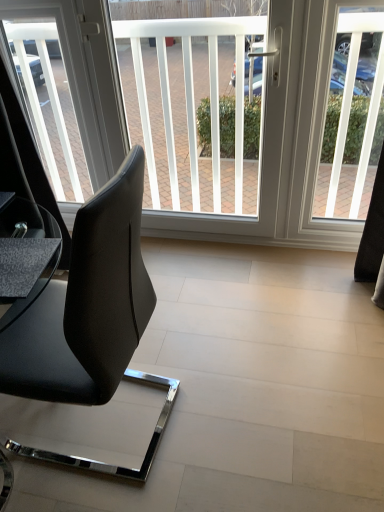
Question: Is transparent glass window screen at upper left, placed as the first window screen when sorted from left to right, thinner than matte black table at lower left?

Choices:
 (A) yes
 (B) no

Answer: (A)

Question: Does transparent glass window screen at upper left, which is the third window screen from right to left, come behind matte black table at lower left?

Choices:
 (A) no
 (B) yes

Answer: (B)

Question: Is transparent glass window screen at upper left, which is the third window screen from right to left, positioned with its back to matte black table at lower left?

Choices:
 (A) no
 (B) yes

Answer: (A)

Question: Would you say matte black table at lower left is part of transparent glass window screen at upper left, which is the third window screen from right to left,'s contents?

Choices:
 (A) yes
 (B) no

Answer: (B)

Question: Considering the relative sizes of transparent glass window screen at upper left, which is the third window screen from right to left, and matte black table at lower left in the image provided, is transparent glass window screen at upper left, which is the third window screen from right to left, wider than matte black table at lower left?

Choices:
 (A) no
 (B) yes

Answer: (A)

Question: Is point (49, 96) positioned closer to the camera than point (43, 240)?

Choices:
 (A) farther
 (B) closer

Answer: (A)

Question: Considering their positions, is transparent glass window screen at upper left, which is the third window screen from right to left, located in front of or behind matte black table at lower left?

Choices:
 (A) behind
 (B) front

Answer: (A)

Question: Is transparent glass window screen at upper left, which is the third window screen from right to left, bigger or smaller than matte black table at lower left?

Choices:
 (A) big
 (B) small

Answer: (A)

Question: Is transparent glass window screen at upper left, which is the third window screen from right to left, to the left or to the right of matte black table at lower left in the image?

Choices:
 (A) right
 (B) left

Answer: (B)

Question: From a real-world perspective, is transparent glass window screen at upper left, which is the third window screen from right to left, physically located above or below white plastic window screen at center, which is counted as the 2th window screen, starting from the right?

Choices:
 (A) below
 (B) above

Answer: (B)

Question: Is transparent glass window screen at upper left, which is the third window screen from right to left, wider or thinner than white plastic window screen at center, which is counted as the 2th window screen, starting from the right?

Choices:
 (A) thin
 (B) wide

Answer: (A)

Question: Based on their sizes in the image, would you say transparent glass window screen at upper left, placed as the first window screen when sorted from left to right, is bigger or smaller than white plastic window screen at center, which is counted as the 2th window screen, starting from the right?

Choices:
 (A) small
 (B) big

Answer: (A)

Question: Choose the correct answer: Is transparent glass window screen at upper left, placed as the first window screen when sorted from left to right, inside white plastic window screen at center, the 2th window screen in the left-to-right sequence, or outside it?

Choices:
 (A) inside
 (B) outside

Answer: (B)

Question: Based on their positions, is matte black table at lower left located to the left or right of transparent glass window screen at upper left, which is the third window screen from right to left?

Choices:
 (A) left
 (B) right

Answer: (B)

Question: Is matte black table at lower left wider or thinner than transparent glass window screen at upper left, which is the third window screen from right to left?

Choices:
 (A) thin
 (B) wide

Answer: (B)